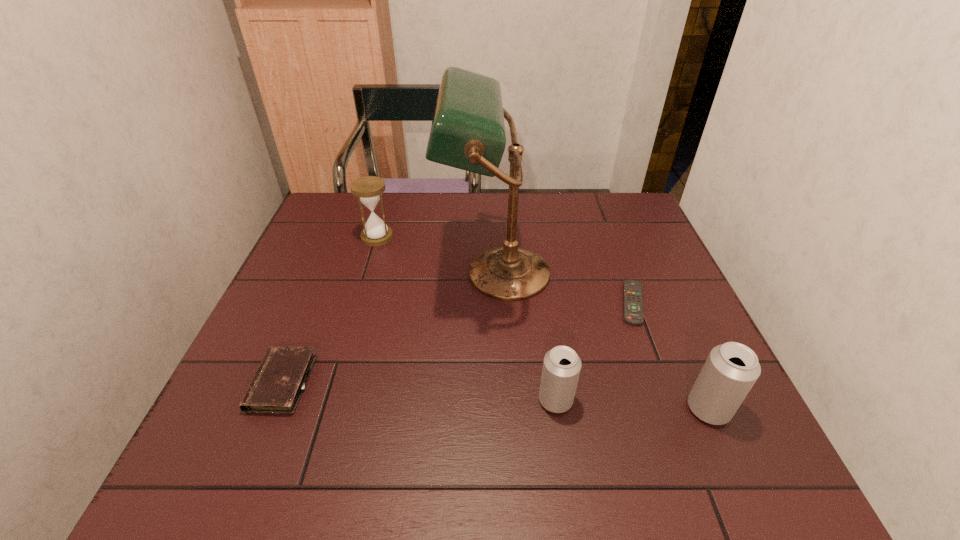
This screenshot has height=540, width=960. Identify the location of beer can situated at the right edge. (731, 369).

Locate an element on the screen. This screenshot has height=540, width=960. remote control located in the right edge section of the desktop is located at coordinates (633, 299).

You are a GUI agent. You are given a task and a screenshot of the screen. Output one action in this format:
    pyautogui.click(x=<x>, y=<y>)
    Task: Click on the object at the near left corner
    This screenshot has height=540, width=960.
    Given the screenshot: What is the action you would take?
    pyautogui.click(x=278, y=383)

At what (x,y) coordinates should I click in order to perform the action: click on object present at the near right corner. Please return your answer as a coordinate pair (x, y). Looking at the image, I should click on (731, 369).

Locate an element on the screen. The image size is (960, 540). free space at the far edge of the desktop is located at coordinates (455, 194).

You are a GUI agent. You are given a task and a screenshot of the screen. Output one action in this format:
    pyautogui.click(x=<x>, y=<y>)
    Task: Click on the blank space at the near edge of the desktop
    The height and width of the screenshot is (540, 960).
    Given the screenshot: What is the action you would take?
    pyautogui.click(x=595, y=408)

Identify the location of vacant space at the left edge. This screenshot has height=540, width=960. (347, 246).

I want to click on free space at the right edge of the desktop, so click(665, 287).

Locate an element on the screen. vacant region at the far left corner of the desktop is located at coordinates (350, 207).

In the image, there is a desktop. Where is `vacant area at the near left corner`? This screenshot has height=540, width=960. vacant area at the near left corner is located at coordinates (256, 431).